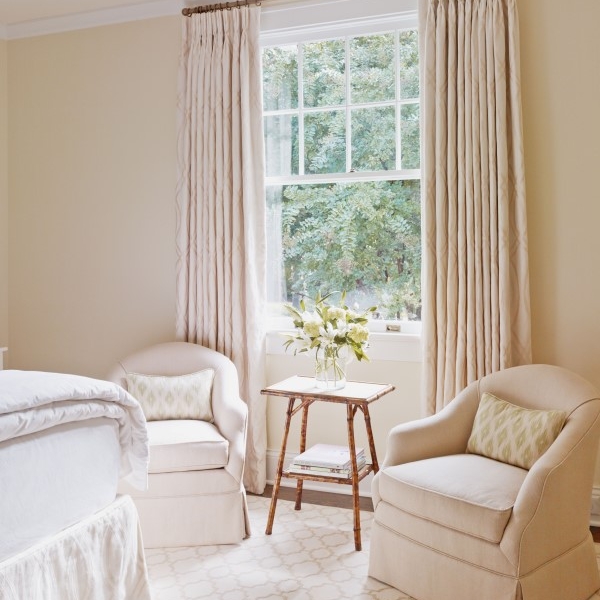
Locate an element on the screen. This screenshot has width=600, height=600. cylindrical glass vase is located at coordinates (328, 373).